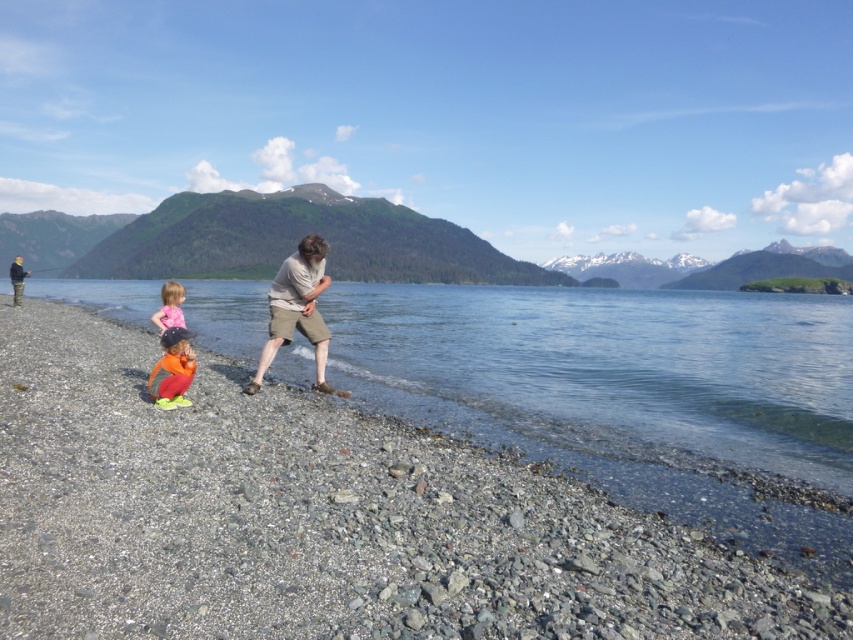
Question: Can you confirm if smooth gravel beach at center is thinner than pink fabric toddler at lower left?

Choices:
 (A) no
 (B) yes

Answer: (A)

Question: Does orange fleece pants at lower left appear over pink fabric toddler at lower left?

Choices:
 (A) no
 (B) yes

Answer: (A)

Question: Which object appears farthest from the camera in this image?

Choices:
 (A) pink fabric toddler at lower left
 (B) smooth gravel beach at center

Answer: (A)

Question: Which point appears closest to the camera in this image?

Choices:
 (A) (138, 577)
 (B) (173, 384)
 (C) (166, 323)

Answer: (A)

Question: Is smooth gravel beach at center above orange fleece pants at lower left?

Choices:
 (A) no
 (B) yes

Answer: (A)

Question: Which point is farther from the camera taking this photo?

Choices:
 (A) click(x=177, y=369)
 (B) click(x=592, y=556)
 (C) click(x=178, y=288)

Answer: (C)